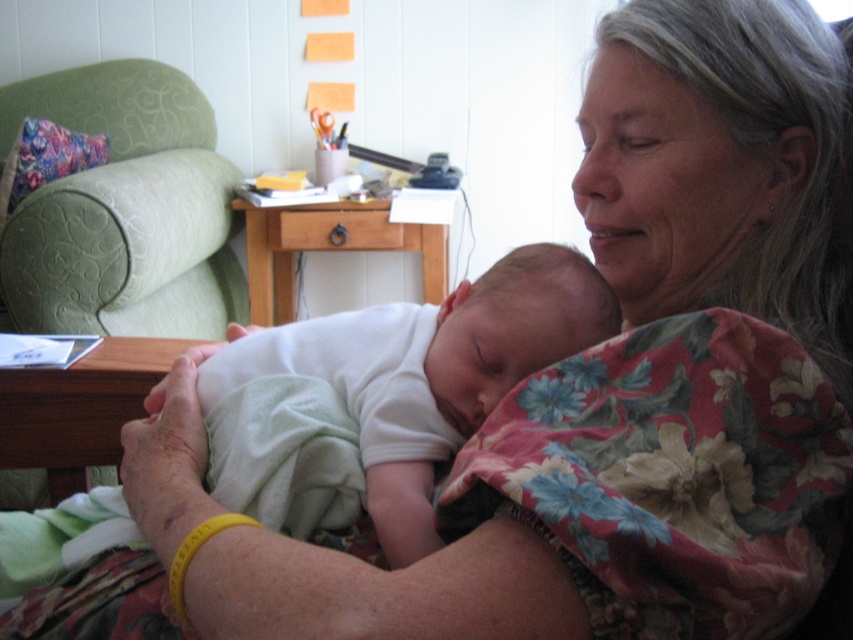
Between green fabric armchair at left and white soft fabric newborn at center, which one is positioned lower?

white soft fabric newborn at center is below.

Where is `green fabric armchair at left`? The height and width of the screenshot is (640, 853). green fabric armchair at left is located at coordinates (123, 211).